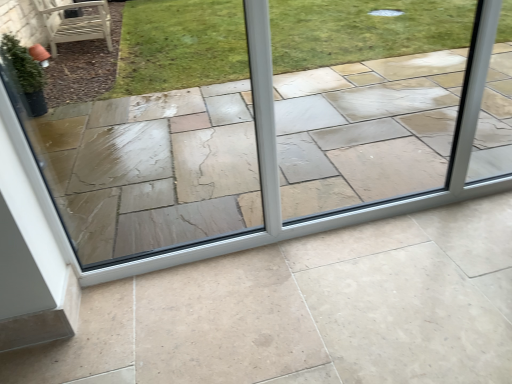
This screenshot has height=384, width=512. Describe the element at coordinates (262, 171) in the screenshot. I see `transparent glass window at center` at that location.

You are a GUI agent. You are given a task and a screenshot of the screen. Output one action in this format:
    pyautogui.click(x=<x>, y=<y>)
    Task: Click on the transparent glass window at center
    This screenshot has height=384, width=512.
    Given the screenshot: What is the action you would take?
    pos(262,171)

In order to face transparent glass window at center, should I rotate leftwards or rightwards?

It's best to rotate right around 8.182 degrees.

This screenshot has height=384, width=512. Find the location of `transparent glass window at center`. transparent glass window at center is located at coordinates (262, 171).